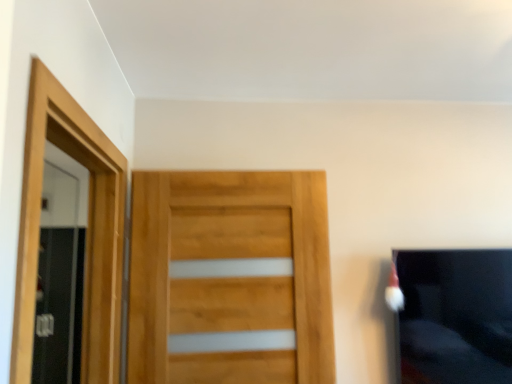
Question: Is wooden screen door at left, the 2th screen door when ordered from right to left, bigger or smaller than black fabric couch at right?

Choices:
 (A) big
 (B) small

Answer: (A)

Question: Relative to black fabric couch at right, is wooden screen door at left, the 2th screen door when ordered from right to left, in front or behind?

Choices:
 (A) behind
 (B) front

Answer: (A)

Question: Estimate the real-world distances between objects in this image. Which object is closer to the natural wood door at center?

Choices:
 (A) wooden screen door at left, which is the 1th screen door in back-to-front order
 (B) black fabric couch at right
 (C) natural wood screen door at left, the 2th screen door from the back

Answer: (C)

Question: Estimate the real-world distances between objects in this image. Which object is closer to the natural wood screen door at left, the 2th screen door from the back?

Choices:
 (A) natural wood door at center
 (B) wooden screen door at left, the first screen door in the left-to-right sequence
 (C) black fabric couch at right

Answer: (A)